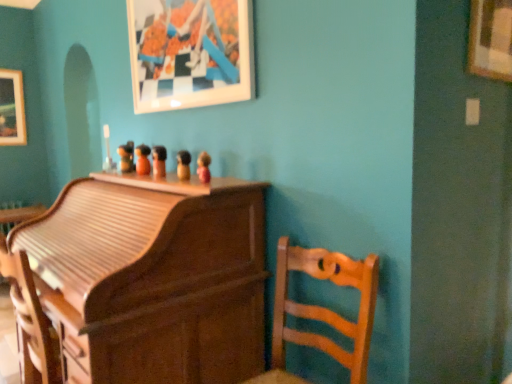
The image size is (512, 384). I want to click on vacant space to the right of wooden figurine at center, which is counted as the fourth toy, starting from the left, so click(x=212, y=179).